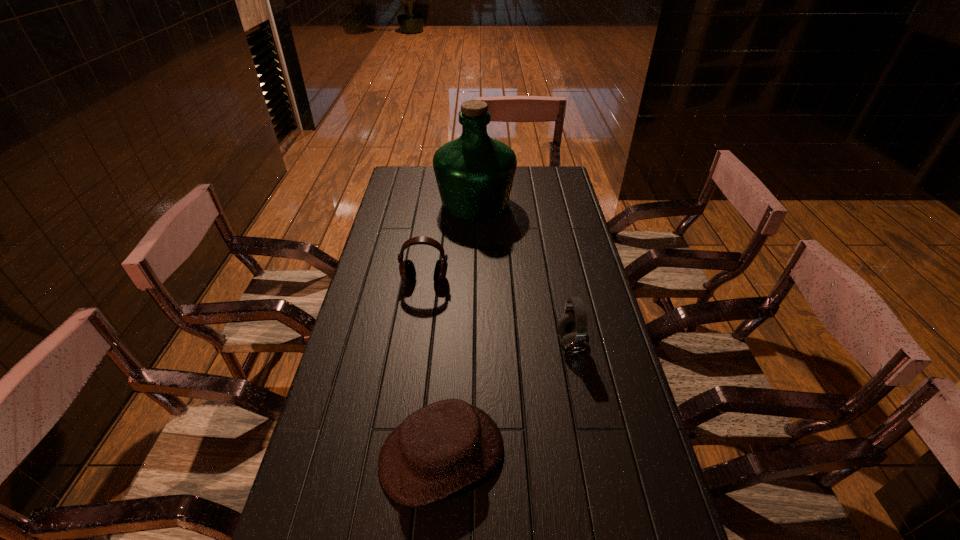
Where is `blank space located 0.130m on the ear cups of the right headset`? blank space located 0.130m on the ear cups of the right headset is located at coordinates (513, 343).

This screenshot has height=540, width=960. What are the coordinates of `free space located on the ear cups of the right headset` in the screenshot? It's located at (454, 343).

Image resolution: width=960 pixels, height=540 pixels. I want to click on vacant space located on the ear cups of the right headset, so click(x=489, y=343).

I want to click on vacant area situated on the back of the nearest object, so click(449, 347).

Where is `object that is at the far edge`? This screenshot has height=540, width=960. object that is at the far edge is located at coordinates (474, 173).

The height and width of the screenshot is (540, 960). I want to click on object present at the left edge, so click(407, 271).

Identify the location of object located at the right edge. (572, 326).

The image size is (960, 540). What are the coordinates of `vacant space at the left edge of the desktop` in the screenshot? It's located at (341, 430).

Where is `vacant region at the right edge of the desktop`? This screenshot has width=960, height=540. vacant region at the right edge of the desktop is located at coordinates (587, 274).

Locate an element on the screen. vacant area at the far right corner of the desktop is located at coordinates (534, 178).